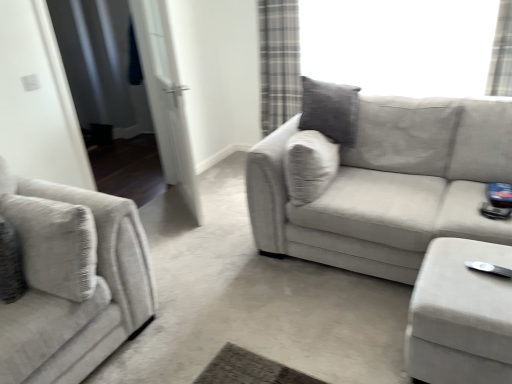
Find the location of `free spot in front of white plastic wii controller at lower right`. free spot in front of white plastic wii controller at lower right is located at coordinates (494, 296).